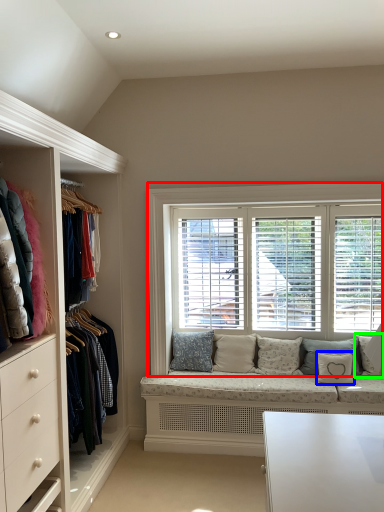
Question: Which object is the closest to the window (highlighted by a red box)? Choose among these: pillow (highlighted by a blue box) or pillow (highlighted by a green box).

Choices:
 (A) pillow
 (B) pillow

Answer: (A)